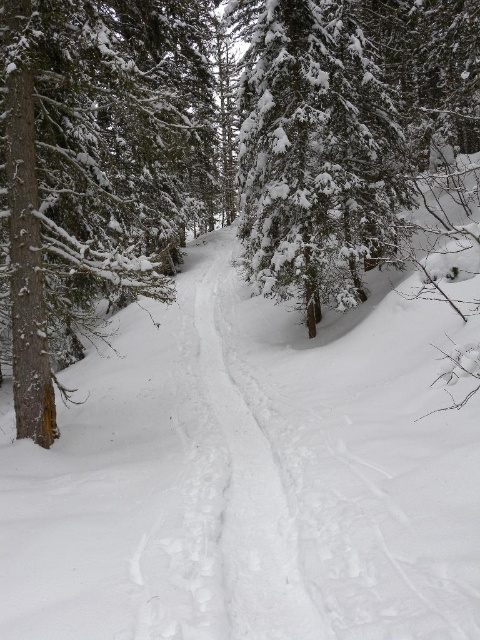
You are an explorer in the forest and need to decide whether to walk around the brown wood tree at left or take the white snow trail at center. Which path is wider?

The brown wood tree at left is larger in size than the white snow trail at center, so the white snow trail at center is narrower than the tree. Therefore, the path around the brown wood tree at left is wider than the white snow trail at center, so the explorer should choose the path around the brown wood tree at left.

You are an observer standing in the forest looking at the green textured pine tree at left and the brown wood tree at left. Which tree is positioned higher in the image?

The green textured pine tree at left is positioned higher in the image than the brown wood tree at left.